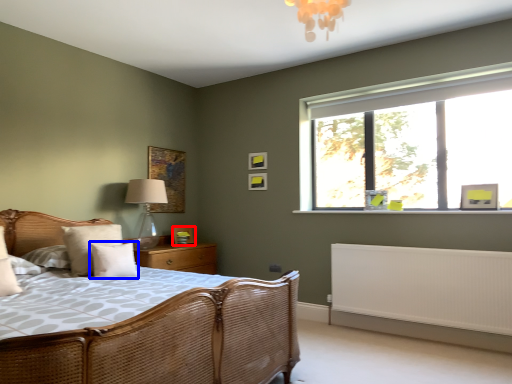
Question: Which point is further to the camera, picture frame (highlighted by a red box) or pillow (highlighted by a blue box)?

Choices:
 (A) picture frame
 (B) pillow

Answer: (A)